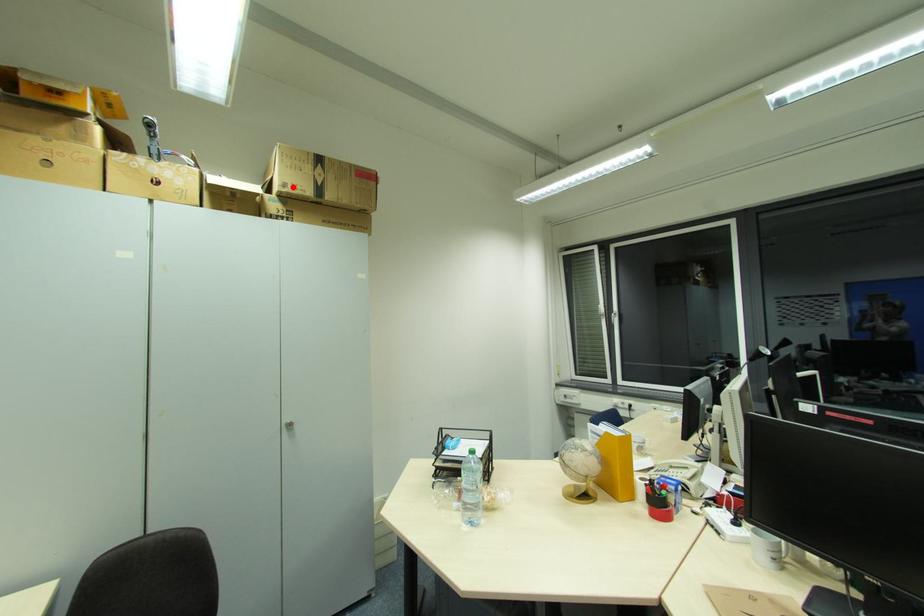
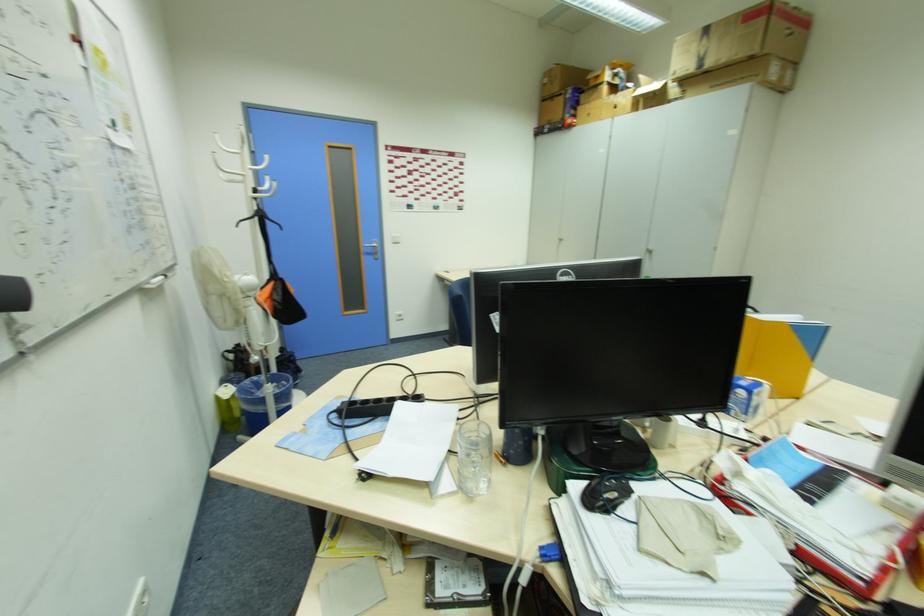
Find the pixel in the second image that matches the highlighted location in the first image.

(685, 71)